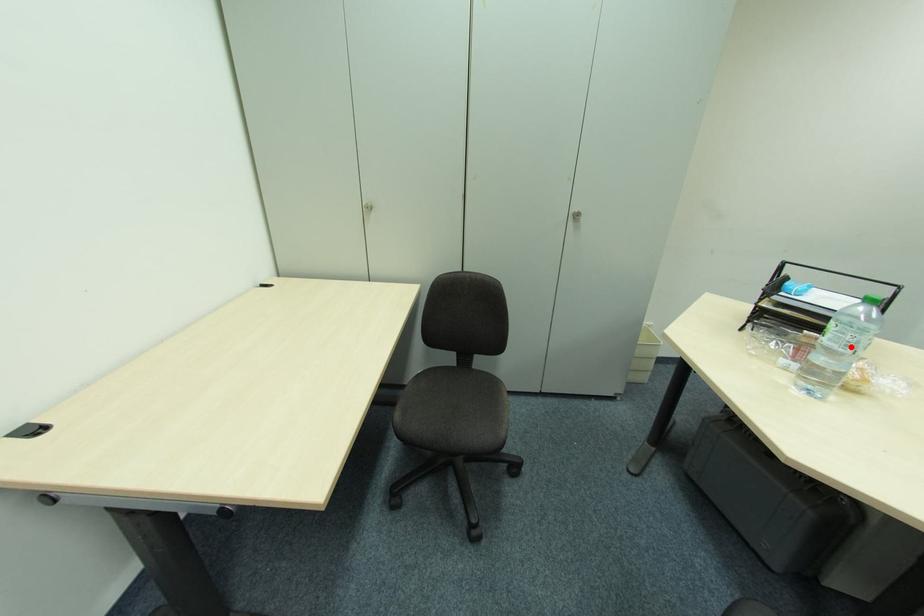
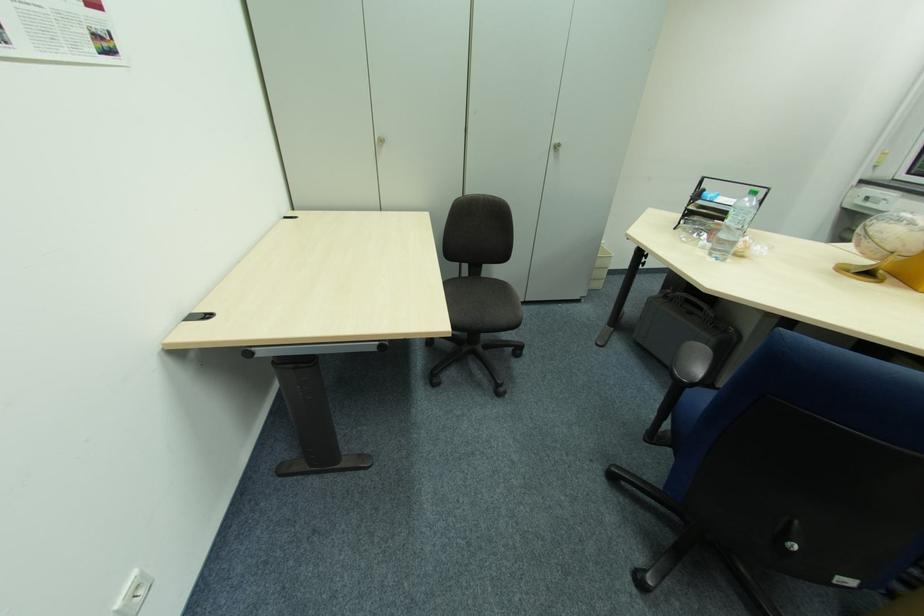
Find the pixel in the second image that matches the highlighted location in the first image.

(743, 224)